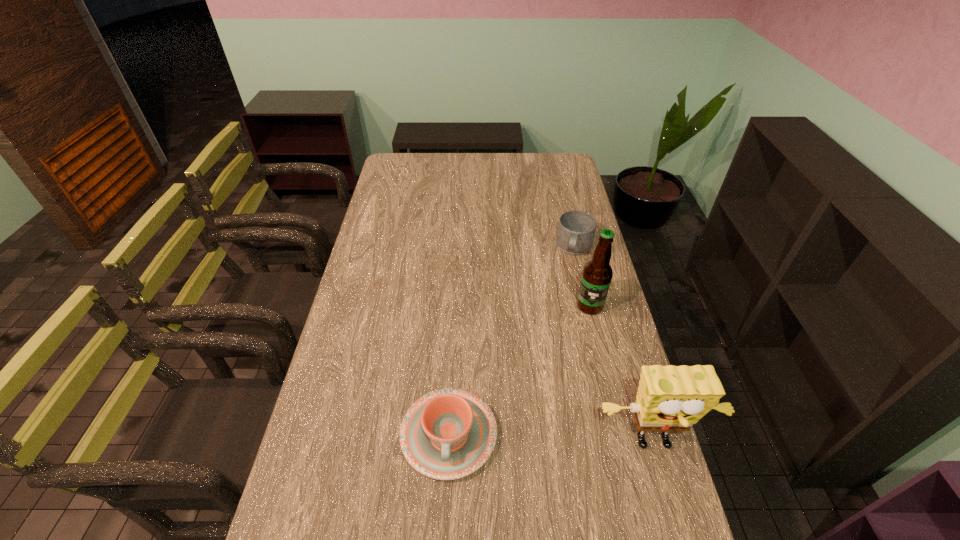
Where is `free spot on the desktop that is between the chinaware and the sponge and is positioned on the label of the beer bottle`? This screenshot has height=540, width=960. free spot on the desktop that is between the chinaware and the sponge and is positioned on the label of the beer bottle is located at coordinates (538, 439).

Image resolution: width=960 pixels, height=540 pixels. Find the location of `free spot on the desktop that is between the chinaware and the sponge and is positioned on the side of the mug with the handle`. free spot on the desktop that is between the chinaware and the sponge and is positioned on the side of the mug with the handle is located at coordinates (524, 438).